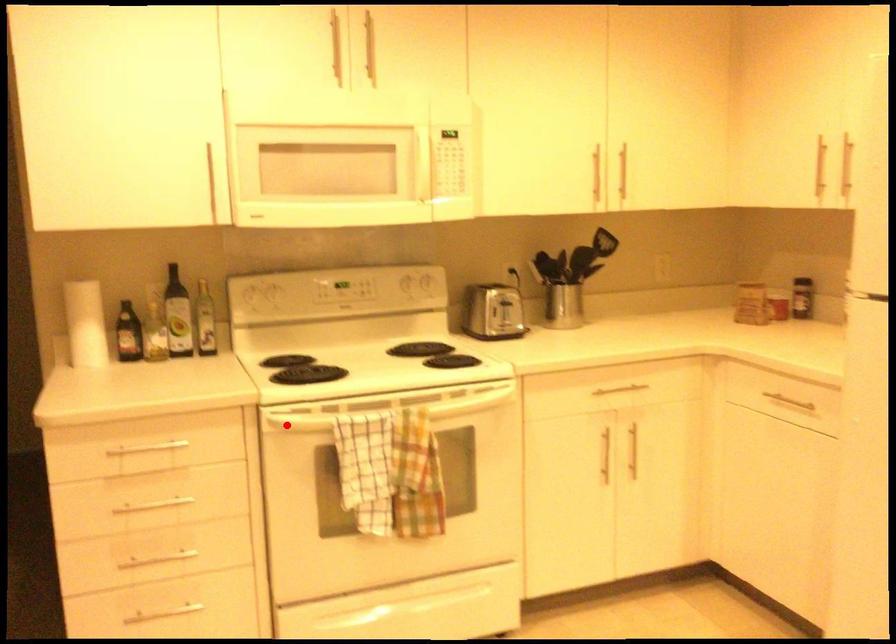
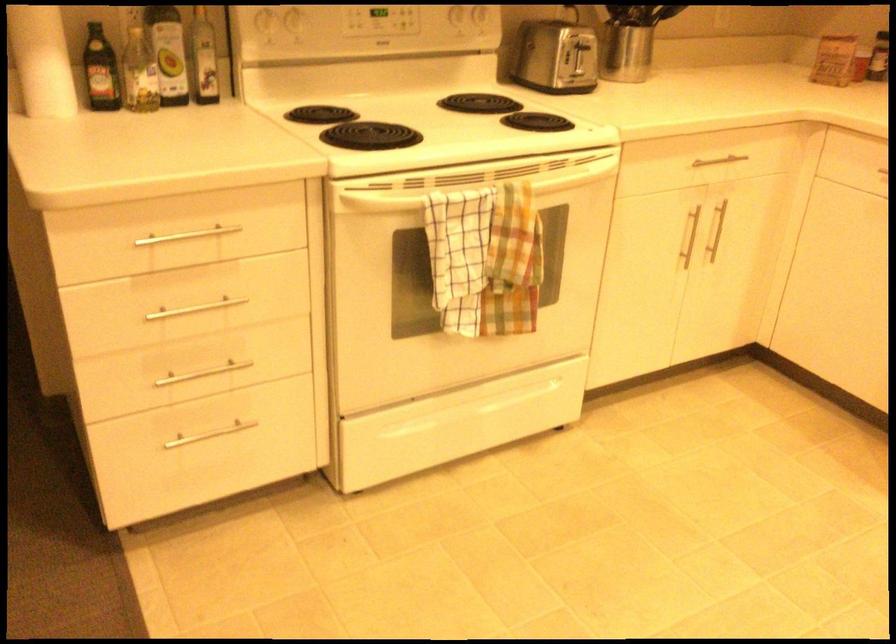
Question: A red point is marked in image1. In image2, is the corresponding 3D point closer to the camera or farther? Reply with the corresponding letter.

Choices:
 (A) The corresponding 3D point is closer.
 (B) The corresponding 3D point is farther.

Answer: (A)